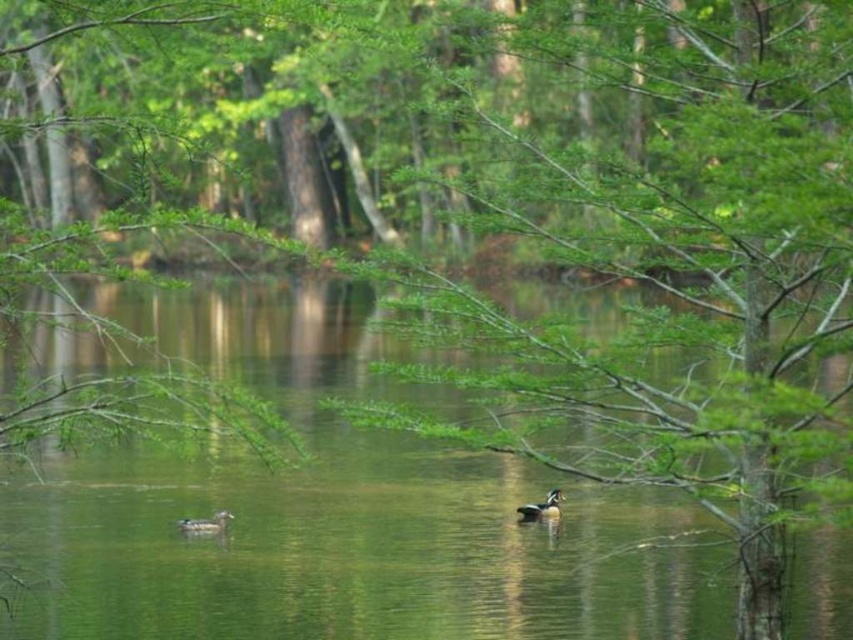
Is green water at center thinner than shiny brown duck at center?

No, green water at center is not thinner than shiny brown duck at center.

The width and height of the screenshot is (853, 640). Describe the element at coordinates (337, 509) in the screenshot. I see `green water at center` at that location.

Which is behind, point (119, 579) or point (555, 499)?

Point (555, 499)

This screenshot has height=640, width=853. In order to click on green water at center in this screenshot , I will do `click(337, 509)`.

Who is more distant from viewer, (x=550, y=490) or (x=196, y=518)?

Point (x=550, y=490)

Can you confirm if shiny brown duck at center is smaller than shiny brown duck at lower left?

Incorrect, shiny brown duck at center is not smaller in size than shiny brown duck at lower left.

This screenshot has width=853, height=640. What do you see at coordinates (543, 508) in the screenshot? I see `shiny brown duck at center` at bounding box center [543, 508].

Locate an element on the screen. This screenshot has width=853, height=640. shiny brown duck at center is located at coordinates (543, 508).

Can you confirm if green water at center is positioned below shiny brown duck at lower left?

No, green water at center is not below shiny brown duck at lower left.

Is green water at center to the left of shiny brown duck at lower left from the viewer's perspective?

No, green water at center is not to the left of shiny brown duck at lower left.

The image size is (853, 640). Describe the element at coordinates (337, 509) in the screenshot. I see `green water at center` at that location.

Image resolution: width=853 pixels, height=640 pixels. I want to click on green water at center, so click(337, 509).